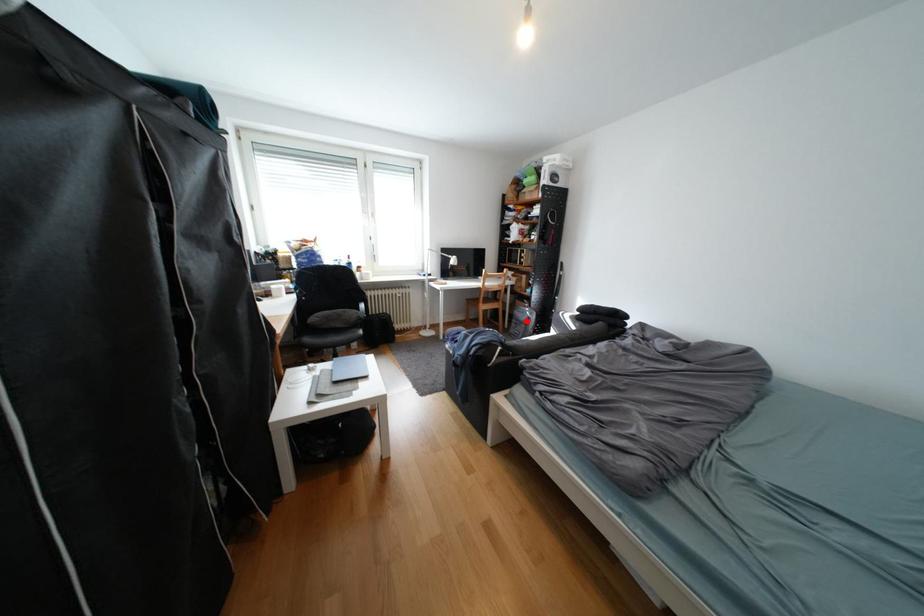
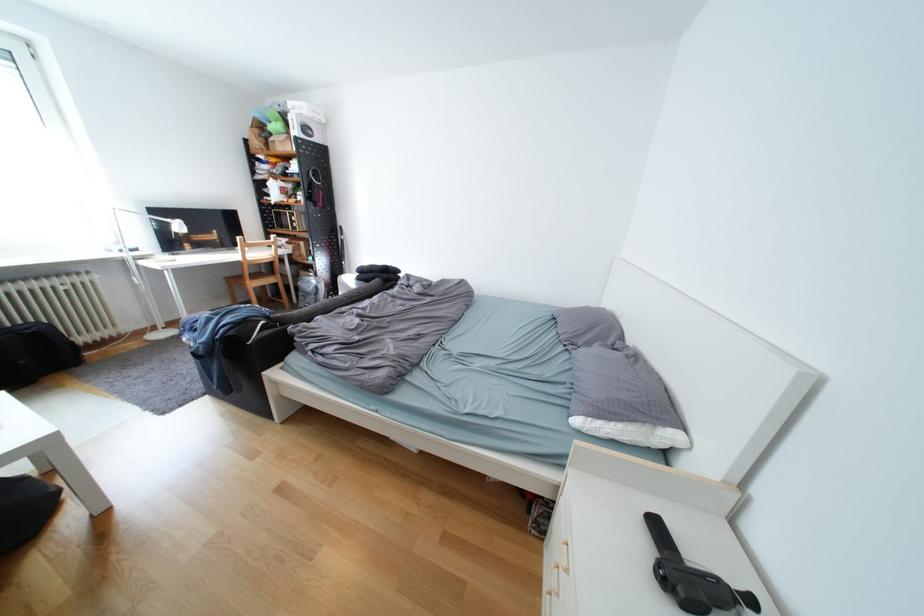
Where in the second image is the point corresponding to the highlighted location from the first image?

(313, 294)